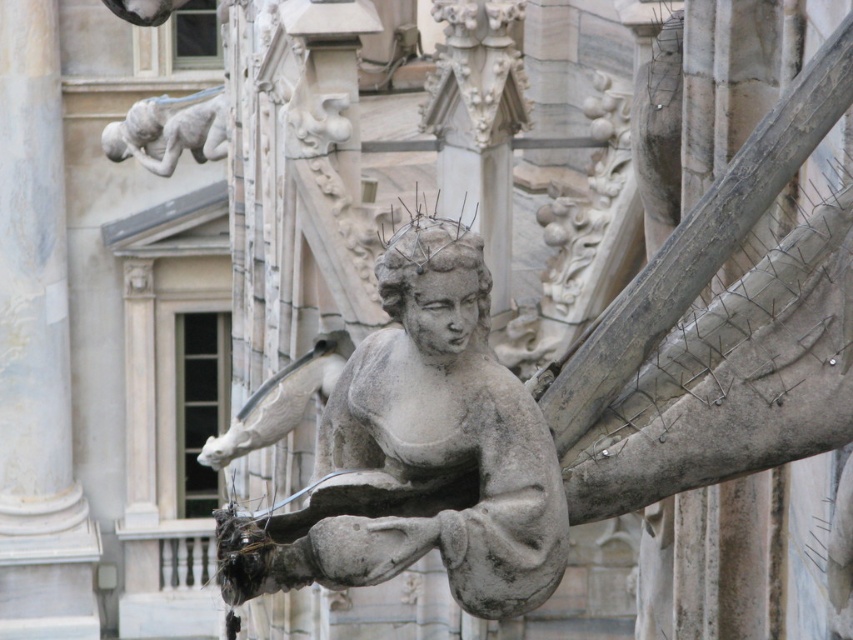
You are an art conservator assessing the stone sculptures in the cathedral. You notice the gray stone angel at center and the gray stone gargoyle at upper left. Which sculpture has a smaller width?

The gray stone angel at center has a smaller width than the gray stone gargoyle at upper left.

You are an art conservator examining the stone sculpture. You notice two points on the sculpture marked at coordinates point [323,547] and point [24,205]. Which point is closer to the viewer?

Point [323,547] is in front of point [24,205], so it is closer to the viewer.